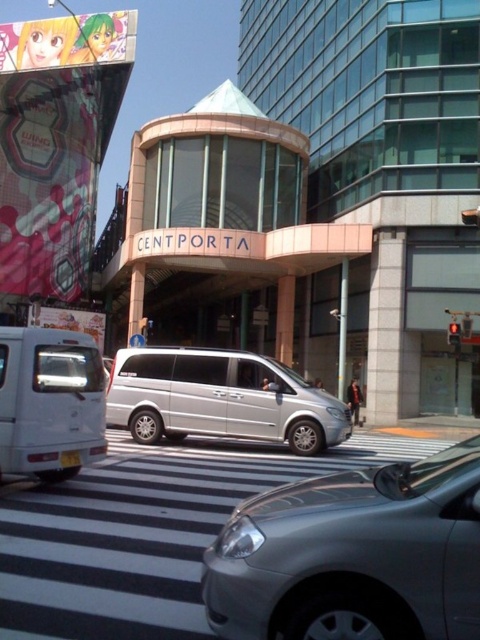
Is point (346, 596) positioned before point (284, 372)?

Yes, it is in front of point (284, 372).

How distant is silver metallic car at center from silver metallic van at center?

A distance of 7.55 meters exists between silver metallic car at center and silver metallic van at center.

Does point (285, 557) come farther from viewer compared to point (233, 380)?

No, (285, 557) is in front of (233, 380).

Identify the location of silver metallic car at center. The width and height of the screenshot is (480, 640). (354, 556).

Is silver metallic van at center smaller than white matte van at left?

No.

What do you see at coordinates (220, 397) in the screenshot? I see `silver metallic van at center` at bounding box center [220, 397].

This screenshot has height=640, width=480. Identify the location of silver metallic van at center. (220, 397).

Does point (479, 621) lie behind point (0, 372)?

No.

Describe the element at coordinates (354, 556) in the screenshot. I see `silver metallic car at center` at that location.

Does point (440, 577) come farther from viewer compared to point (16, 461)?

No, it is in front of (16, 461).

The width and height of the screenshot is (480, 640). In order to click on silver metallic car at center in this screenshot , I will do `click(354, 556)`.